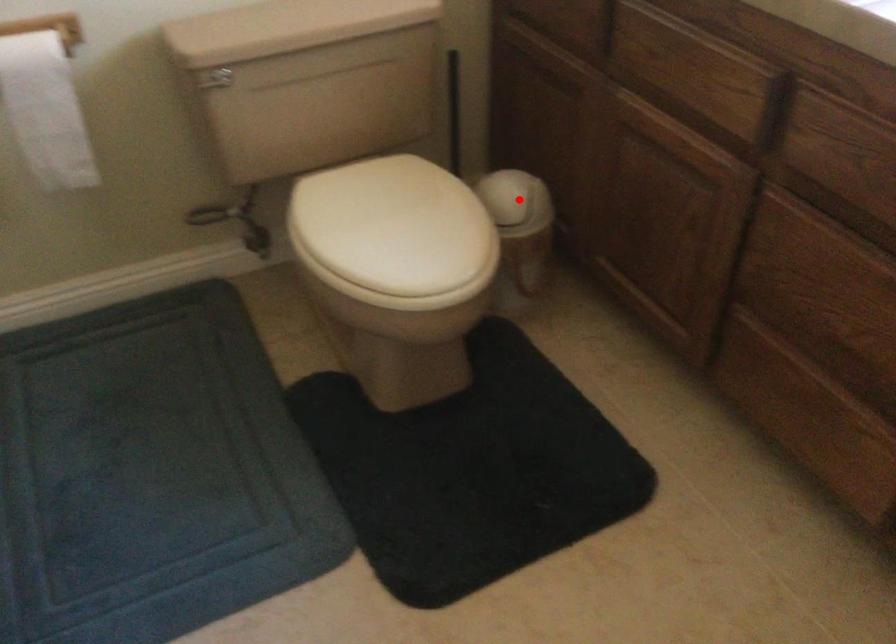
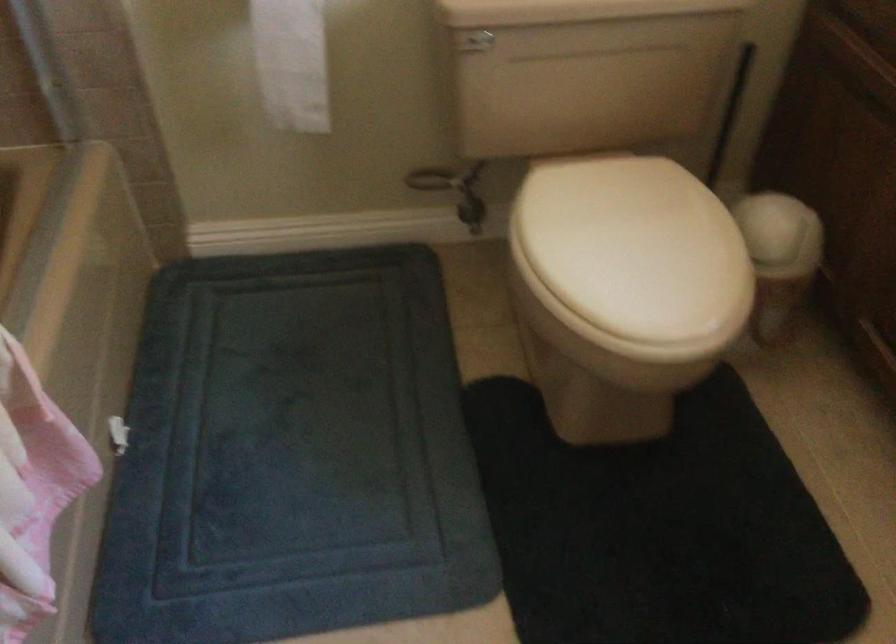
Question: I am providing you with two images of the same scene from different viewpoints. A red point is shown in image1. For the corresponding object point in image2, is it positioned nearer or farther from the camera?

Choices:
 (A) Nearer
 (B) Farther

Answer: (A)